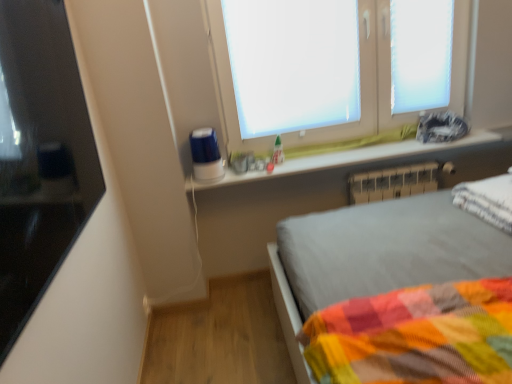
Question: Can you confirm if white frosted glass window at upper center is thinner than white plastic window frame at upper right?

Choices:
 (A) no
 (B) yes

Answer: (A)

Question: Is white frosted glass window at upper center closer to camera compared to white plastic window frame at upper right?

Choices:
 (A) no
 (B) yes

Answer: (B)

Question: Is white frosted glass window at upper center to the left of white plastic window frame at upper right from the viewer's perspective?

Choices:
 (A) yes
 (B) no

Answer: (A)

Question: From a real-world perspective, does white frosted glass window at upper center stand above white plastic window frame at upper right?

Choices:
 (A) no
 (B) yes

Answer: (A)

Question: Considering the relative sizes of white frosted glass window at upper center and white plastic window frame at upper right in the image provided, is white frosted glass window at upper center wider than white plastic window frame at upper right?

Choices:
 (A) no
 (B) yes

Answer: (B)

Question: Is white frosted glass window at upper center smaller than white plastic window frame at upper right?

Choices:
 (A) yes
 (B) no

Answer: (B)

Question: From a real-world perspective, does white plastic radiator at lower right sit lower than white matte window screen at upper center?

Choices:
 (A) yes
 (B) no

Answer: (A)

Question: Would you say white plastic radiator at lower right is outside white matte window screen at upper center?

Choices:
 (A) no
 (B) yes

Answer: (B)

Question: Would you say white plastic radiator at lower right is a long distance from white matte window screen at upper center?

Choices:
 (A) yes
 (B) no

Answer: (B)

Question: Considering the relative positions of white plastic radiator at lower right and white matte window screen at upper center in the image provided, is white plastic radiator at lower right to the right of white matte window screen at upper center from the viewer's perspective?

Choices:
 (A) no
 (B) yes

Answer: (B)

Question: Considering the relative positions of white plastic radiator at lower right and white matte window screen at upper center in the image provided, is white plastic radiator at lower right behind white matte window screen at upper center?

Choices:
 (A) no
 (B) yes

Answer: (B)

Question: Is white plastic radiator at lower right shorter than white matte window screen at upper center?

Choices:
 (A) yes
 (B) no

Answer: (A)

Question: Is white soft pillow at right taller than black glossy monitor at left?

Choices:
 (A) yes
 (B) no

Answer: (B)